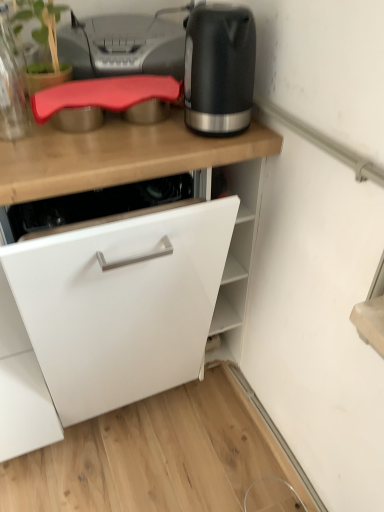
Question: Is translucent glass jar at upper left located outside white matte cabinet at center?

Choices:
 (A) no
 (B) yes

Answer: (B)

Question: Does translucent glass jar at upper left have a larger size compared to white matte cabinet at center?

Choices:
 (A) yes
 (B) no

Answer: (B)

Question: From the image's perspective, would you say translucent glass jar at upper left is shown under white matte cabinet at center?

Choices:
 (A) yes
 (B) no

Answer: (B)

Question: Does translucent glass jar at upper left have a greater height compared to white matte cabinet at center?

Choices:
 (A) no
 (B) yes

Answer: (A)

Question: From the image's perspective, is translucent glass jar at upper left above white matte cabinet at center?

Choices:
 (A) no
 (B) yes

Answer: (B)

Question: From a real-world perspective, is translucent glass jar at upper left below white matte cabinet at center?

Choices:
 (A) no
 (B) yes

Answer: (A)

Question: From the image's perspective, is matte gray printer at upper center under translucent glass jar at upper left?

Choices:
 (A) yes
 (B) no

Answer: (B)

Question: Is matte gray printer at upper center facing towards translucent glass jar at upper left?

Choices:
 (A) yes
 (B) no

Answer: (B)

Question: From the image's perspective, does matte gray printer at upper center appear higher than translucent glass jar at upper left?

Choices:
 (A) no
 (B) yes

Answer: (B)

Question: Is matte gray printer at upper center taller than translucent glass jar at upper left?

Choices:
 (A) no
 (B) yes

Answer: (A)

Question: From a real-world perspective, is matte gray printer at upper center on translucent glass jar at upper left?

Choices:
 (A) no
 (B) yes

Answer: (A)

Question: Can you confirm if matte gray printer at upper center is positioned to the right of translucent glass jar at upper left?

Choices:
 (A) yes
 (B) no

Answer: (A)

Question: From a real-world perspective, is white matte cabinet at center below matte black kettle at upper right?

Choices:
 (A) yes
 (B) no

Answer: (A)